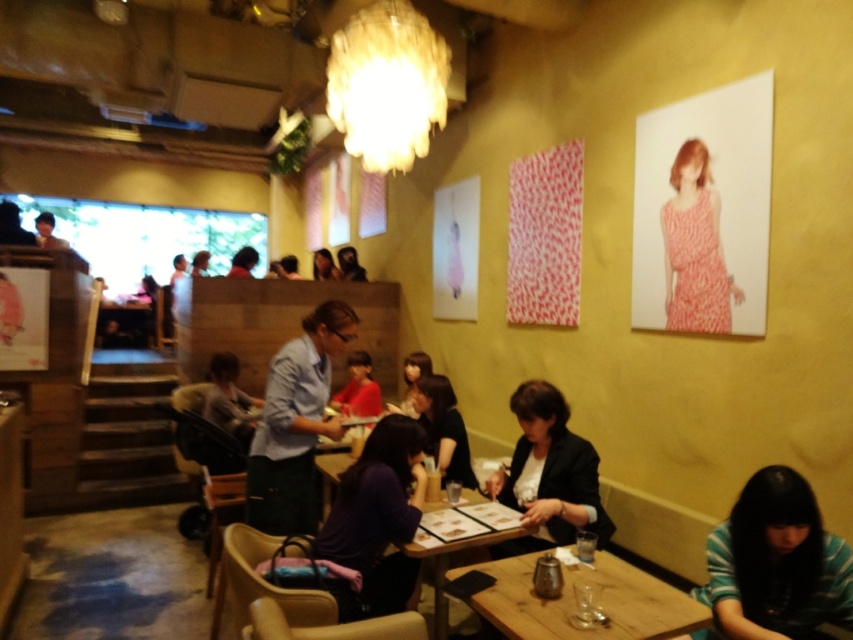
You are a customer sitting at a table in this cozy cafe. You notice two points marked in the room. The first point is at coordinate point (x=682, y=180) and the second is at point (x=448, y=413). If you want to reach the point that is closer to you without moving your chair, which coordinate should you aim for?

The point at coordinate (x=682, y=180) is closer to the viewer, so you should aim for point (x=682, y=180).

You are a customer sitting at a table in the cozy cafe and you want to ask the server for the menu. The server is wearing a black matte shirt at center. Based on the server location coordinates provided, can you estimate if the server is within your line of sight from your current position at the table?

The black matte shirt at center is located at point (444, 429), which is directly in front of you, so yes, the server is within your line of sight.